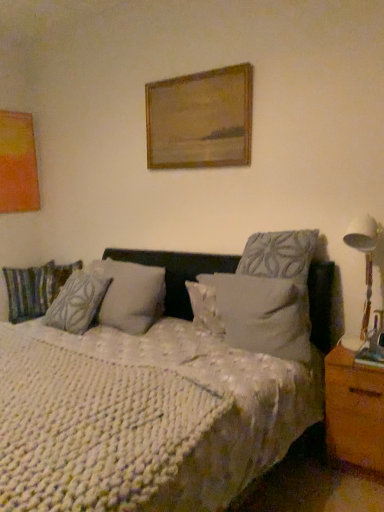
Question: Is textured gray pillow at center, acting as the third pillow starting from the back, turned away from white knitted blanket at center?

Choices:
 (A) no
 (B) yes

Answer: (B)

Question: Is the position of textured gray pillow at center, positioned as the 4th pillow in left-to-right order, less distant than that of white knitted blanket at center?

Choices:
 (A) no
 (B) yes

Answer: (A)

Question: Is white knitted blanket at center a part of textured gray pillow at center, positioned as the 4th pillow in left-to-right order?

Choices:
 (A) no
 (B) yes

Answer: (A)

Question: From the image's perspective, does textured gray pillow at center, positioned as the 4th pillow in left-to-right order, appear higher than white knitted blanket at center?

Choices:
 (A) yes
 (B) no

Answer: (A)

Question: Is textured gray pillow at center, positioned as the 4th pillow in left-to-right order, at the left side of white knitted blanket at center?

Choices:
 (A) yes
 (B) no

Answer: (B)

Question: Does textured gray pillow at center, positioned as the 4th pillow in left-to-right order, lie behind white knitted blanket at center?

Choices:
 (A) no
 (B) yes

Answer: (B)

Question: Does white knitted blanket at center lie in front of white knitted mattress at center?

Choices:
 (A) yes
 (B) no

Answer: (A)

Question: Is white knitted blanket at center in contact with white knitted mattress at center?

Choices:
 (A) yes
 (B) no

Answer: (B)

Question: From the image's perspective, would you say white knitted blanket at center is positioned over white knitted mattress at center?

Choices:
 (A) no
 (B) yes

Answer: (B)

Question: Is white knitted blanket at center surrounding white knitted mattress at center?

Choices:
 (A) no
 (B) yes

Answer: (B)

Question: Is white knitted blanket at center wider than white knitted mattress at center?

Choices:
 (A) no
 (B) yes

Answer: (B)

Question: Is white knitted blanket at center looking in the opposite direction of white knitted mattress at center?

Choices:
 (A) yes
 (B) no

Answer: (A)

Question: From a real-world perspective, is textured gray pillow at center, acting as the second pillow starting from the left, on white textured pillow at center, the fourth pillow positioned from the back?

Choices:
 (A) no
 (B) yes

Answer: (B)